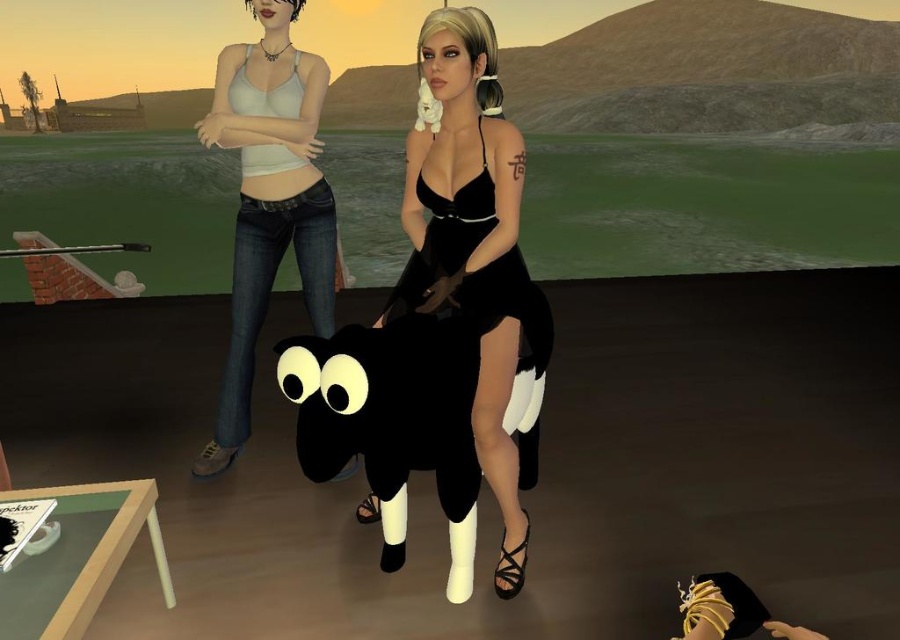
Question: Considering the real-world distances, which object is farthest from the velvet black dress at center?

Choices:
 (A) black satin dress at center
 (B) black matte plush sheep at center
 (C) matte white tank top at center

Answer: (C)

Question: Observing the image, what is the correct spatial positioning of velvet black dress at center in reference to black satin dress at center?

Choices:
 (A) right
 (B) left

Answer: (B)

Question: Among these points, which one is farthest from the camera?

Choices:
 (A) (438, 276)
 (B) (424, 390)
 (C) (446, 266)
 (D) (222, 400)

Answer: (D)

Question: Which of the following is the farthest from the observer?

Choices:
 (A) black matte plush sheep at center
 (B) black satin dress at center
 (C) velvet black dress at center
 (D) matte white tank top at center

Answer: (D)

Question: Is velvet black dress at center above matte white tank top at center?

Choices:
 (A) yes
 (B) no

Answer: (B)

Question: Can you confirm if matte white tank top at center is positioned below black satin dress at center?

Choices:
 (A) yes
 (B) no

Answer: (B)